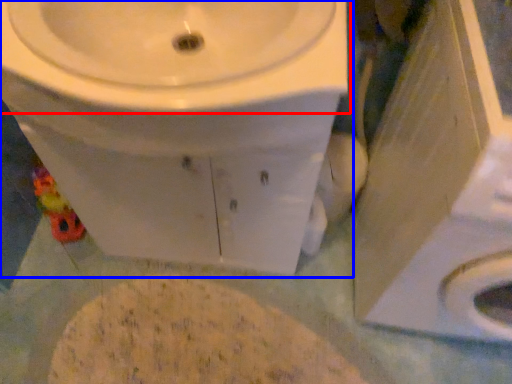
Question: Which object appears closest to the camera in this image, sink (highlighted by a red box) or toilet (highlighted by a blue box)?

Choices:
 (A) sink
 (B) toilet

Answer: (A)